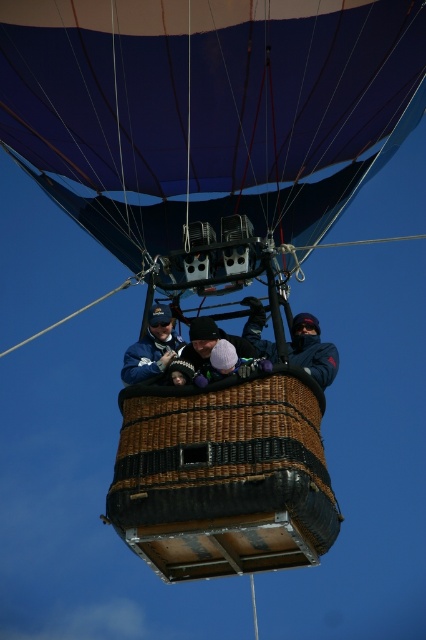
You are a photographer trying to capture a clear shot of the blue fabric jacket at center and the white knit hat at center in the hot air balloon basket. Which object will appear larger in your photo?

The blue fabric jacket at center will appear larger in the photo because it is closer to the viewer than the white knit hat at center.

You are a photographer taking a picture of the hot air balloon. You notice two points on the balloon basket. The first point is at coordinates point (393,16) and the second is at point (138,380). Which point will appear closer to the edge of your camera frame?

Point (138,380) will appear closer to the edge of your camera frame because it is closer to the camera than point (393,16), which is further away.